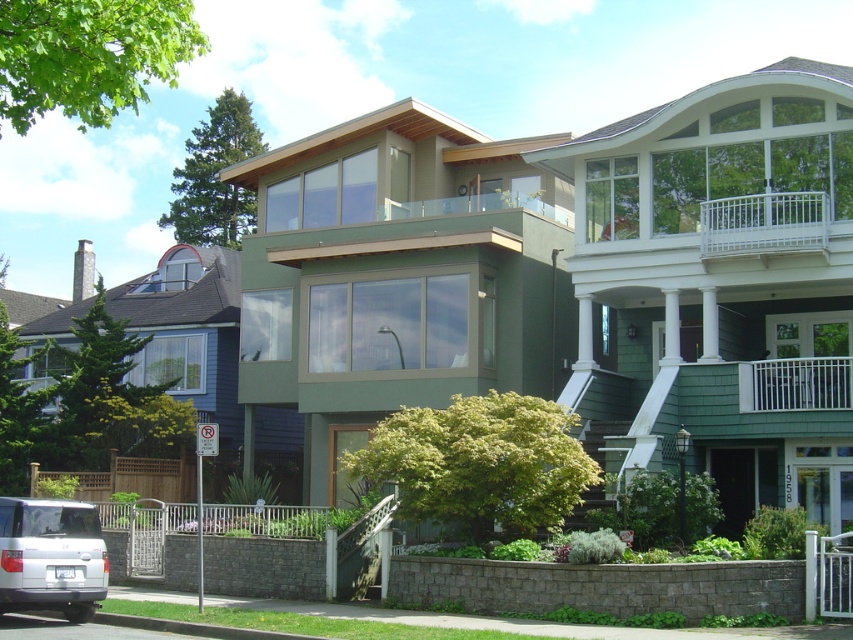
Question: Which is farther from the white wooden railing at upper right?

Choices:
 (A) white metal railing at upper right
 (B) white matte suv at lower left

Answer: (B)

Question: Is white matte suv at lower left above white wooden railing at upper right?

Choices:
 (A) no
 (B) yes

Answer: (A)

Question: Which is nearer to the white wooden railing at upper right?

Choices:
 (A) white matte suv at lower left
 (B) white metal railing at upper right

Answer: (B)

Question: Is white matte suv at lower left thinner than white wooden railing at upper right?

Choices:
 (A) yes
 (B) no

Answer: (A)

Question: Which of the following is the closest to the observer?

Choices:
 (A) (824, 234)
 (B) (746, 369)
 (C) (96, 528)

Answer: (C)

Question: Does white matte suv at lower left lie behind white metal railing at upper right?

Choices:
 (A) no
 (B) yes

Answer: (A)